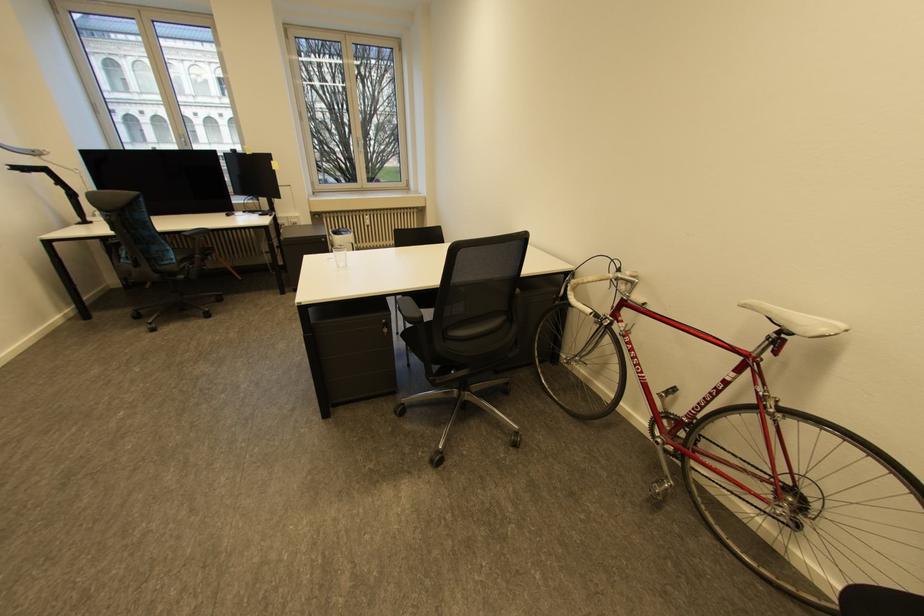
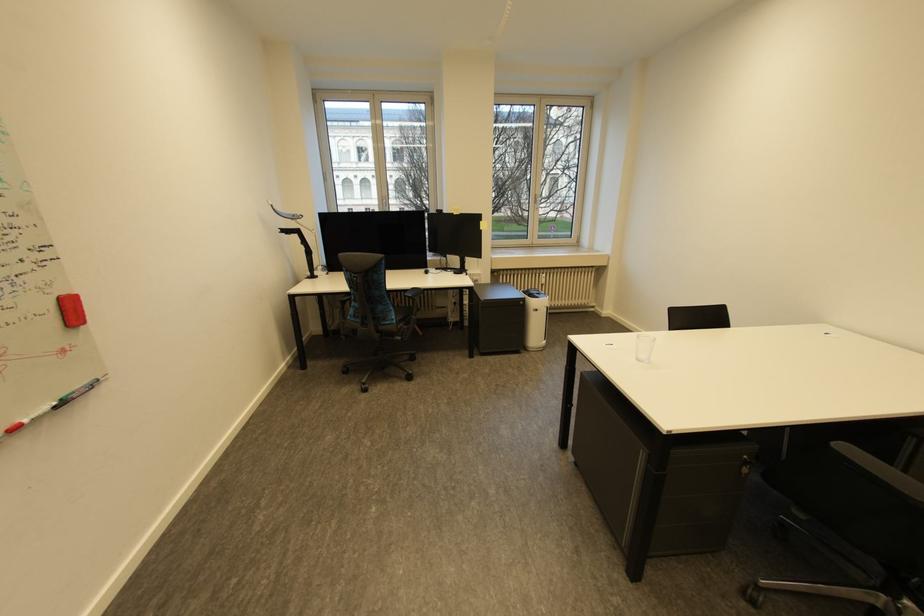
The point at (184,150) is marked in the first image. Where is the corresponding point in the second image?

(383, 209)